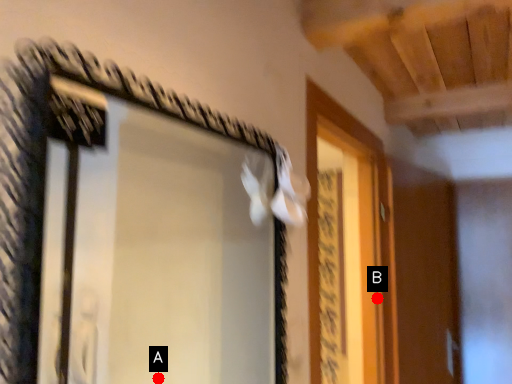
Question: Two points are circled on the image, labeled by A and B beside each circle. Which of the following is the farthest from the observer?

Choices:
 (A) A is further
 (B) B is further

Answer: (B)